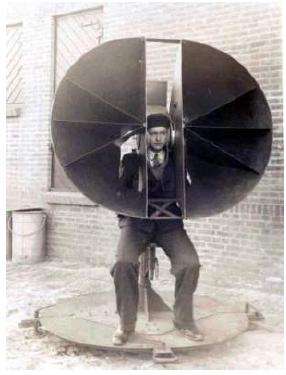
Identify the location of bucket. The width and height of the screenshot is (286, 375). (37, 242).